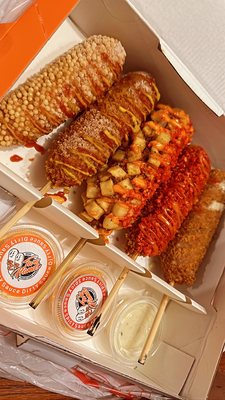
Locate an element on the screen. Image resolution: width=225 pixels, height=400 pixels. box is located at coordinates (182, 345).